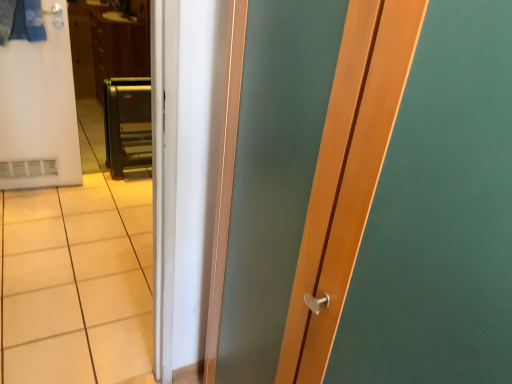
At what (x,y) coordinates should I click in order to perform the action: click on free space underneath white matte refrigerator at left (from a real-world perspective). Please return your answer as a coordinate pair (x, y). Looking at the image, I should click on (37, 185).